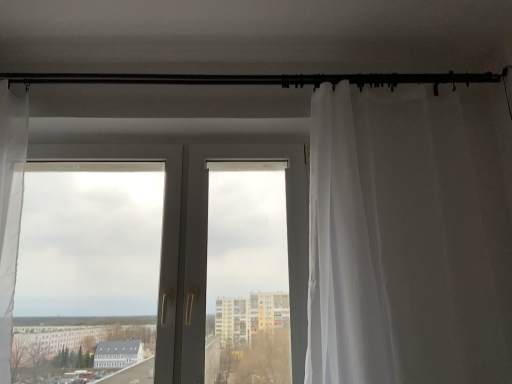
Question: From a real-world perspective, is black metal rod at upper center above or below sheer white curtain at right?

Choices:
 (A) above
 (B) below

Answer: (A)

Question: In terms of size, does black metal rod at upper center appear bigger or smaller than sheer white curtain at right?

Choices:
 (A) small
 (B) big

Answer: (A)

Question: Which object is positioned farthest from the black metal rod at upper center?

Choices:
 (A) white plastic door at center
 (B) sheer white curtain at right

Answer: (A)

Question: Which of these objects is positioned closest to the white plastic door at center?

Choices:
 (A) black metal rod at upper center
 (B) sheer white curtain at right

Answer: (B)